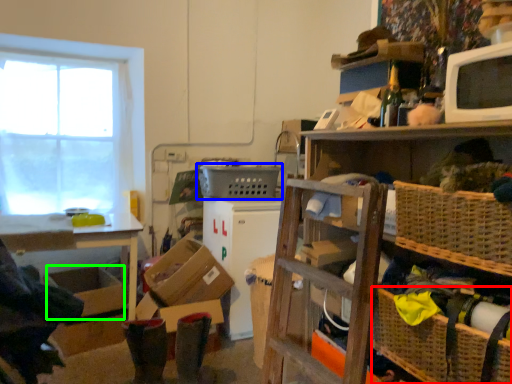
Question: Which object is the farthest from basket (highlighted by a red box)? Choose among these: basket (highlighted by a blue box) or storage box (highlighted by a green box).

Choices:
 (A) basket
 (B) storage box

Answer: (B)